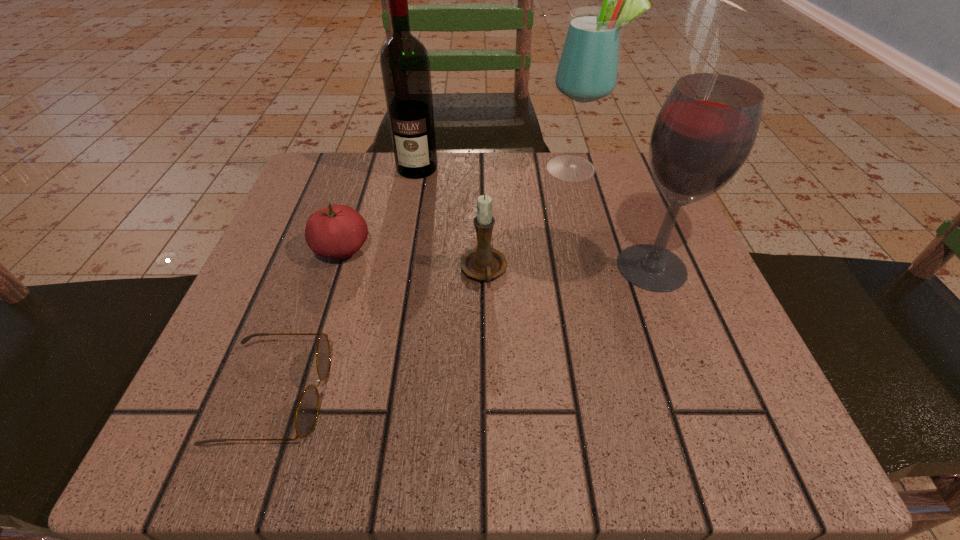
In order to click on vacant space situated 0.080m on the side of the fourth object from left to right with the handle in this screenshot , I will do `click(485, 334)`.

Locate an element on the screen. This screenshot has width=960, height=540. free spot located 0.130m on the back of the tomato is located at coordinates (361, 190).

Where is `vacant space located on the lenses of the shortest object`? vacant space located on the lenses of the shortest object is located at coordinates (547, 395).

Find the location of a particular element. The image size is (960, 540). object situated at the near edge is located at coordinates (307, 411).

Locate an element on the screen. This screenshot has height=540, width=960. tomato at the left edge is located at coordinates (338, 231).

The width and height of the screenshot is (960, 540). Identify the location of sunglasses present at the left edge. (307, 411).

Locate an element on the screen. This screenshot has width=960, height=540. object at the near left corner is located at coordinates (307, 411).

Where is `object located in the far right corner section of the desktop`? The width and height of the screenshot is (960, 540). object located in the far right corner section of the desktop is located at coordinates [x=588, y=67].

Where is `free space at the far edge of the desktop`? This screenshot has width=960, height=540. free space at the far edge of the desktop is located at coordinates (493, 182).

What are the coordinates of `vacant space at the near edge of the desktop` in the screenshot? It's located at (385, 426).